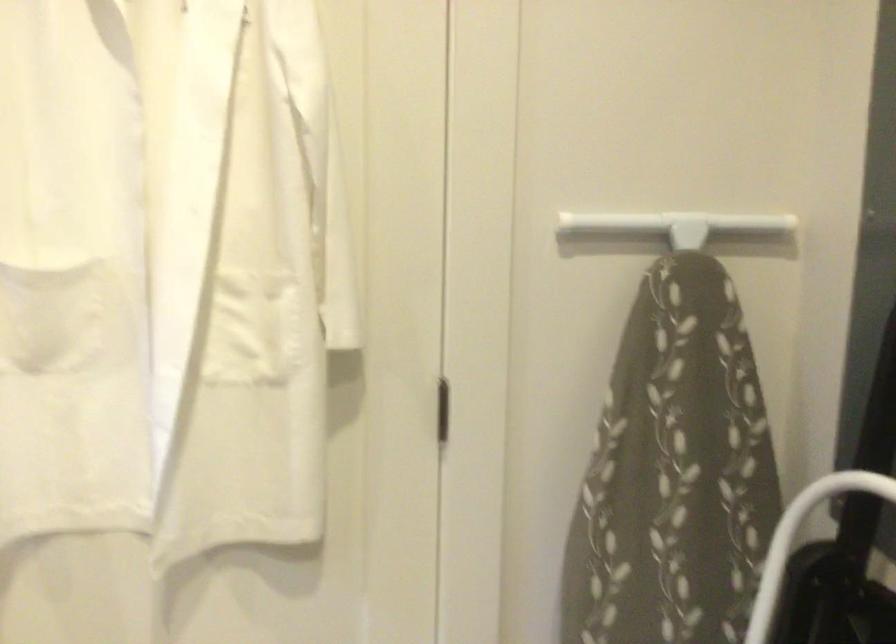
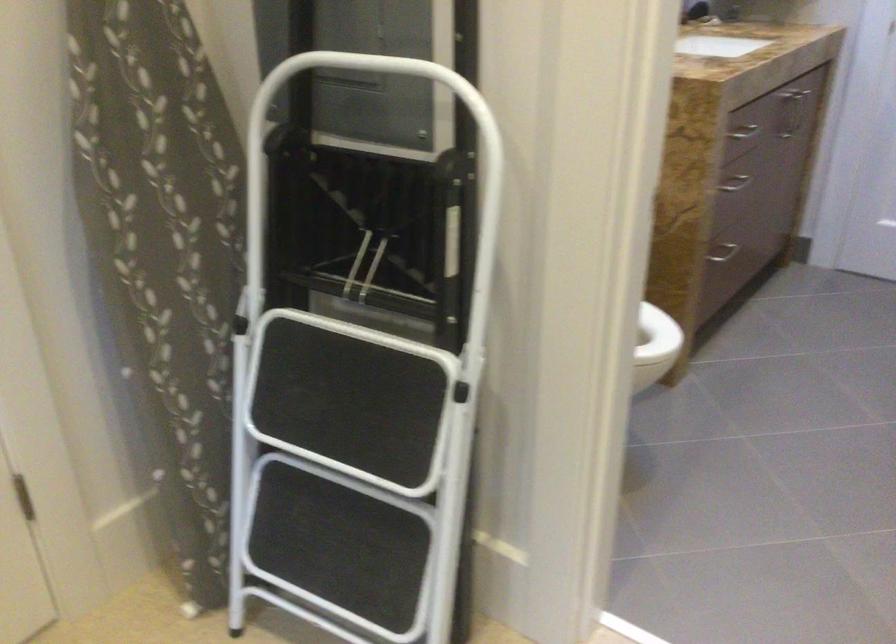
How did the camera likely rotate?

The rotation direction of the camera is right-down.